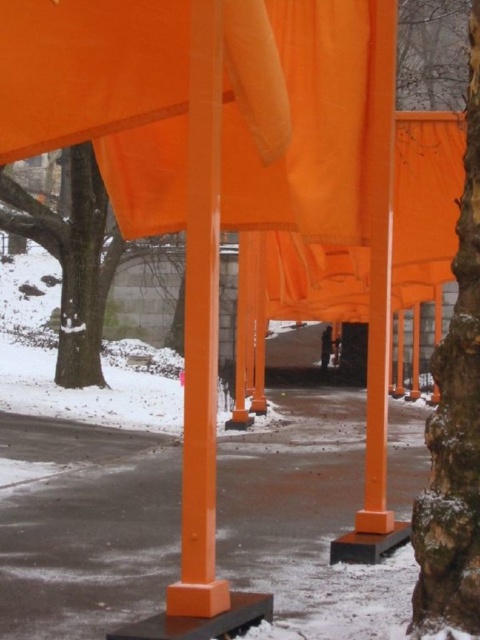
Is smooth bark tree at right smaller than smooth bark tree at lower left?

Yes.

Can you confirm if smooth bark tree at right is positioned to the right of smooth bark tree at lower left?

Indeed, smooth bark tree at right is positioned on the right side of smooth bark tree at lower left.

Measure the distance between smooth bark tree at right and camera.

smooth bark tree at right and camera are 3.74 meters apart.

Find the location of a particular element. The image size is (480, 640). smooth bark tree at right is located at coordinates (456, 417).